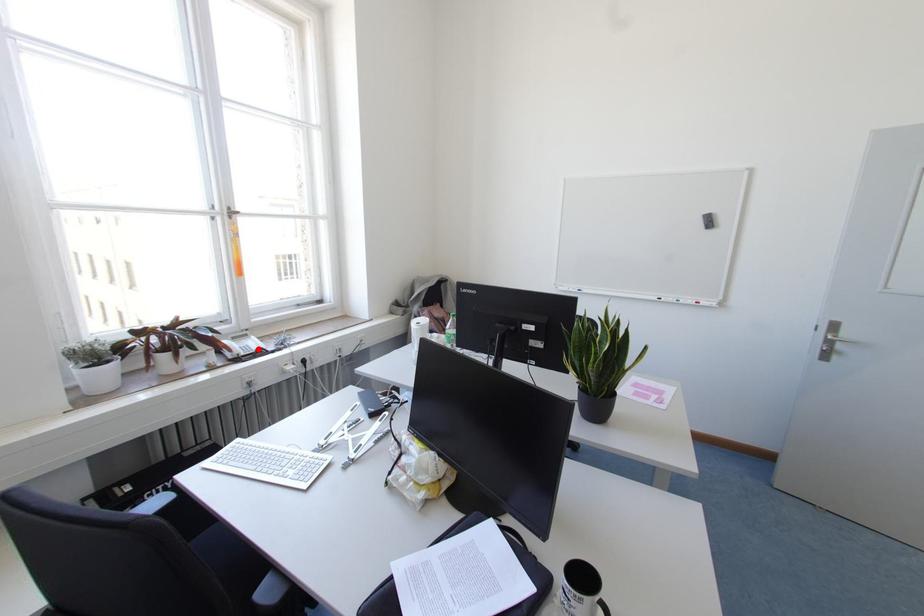
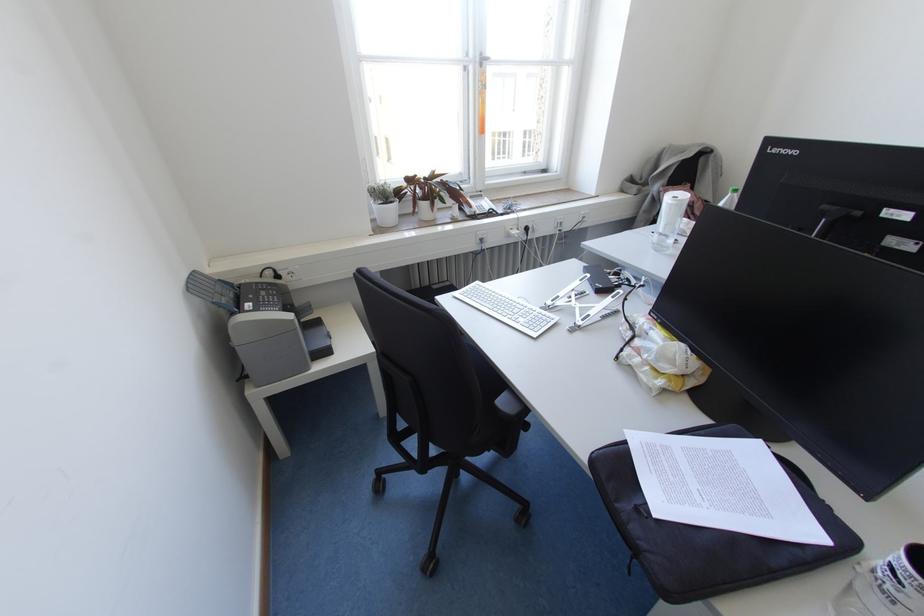
Question: I am providing you with two images of the same scene from different viewpoints. In image1, a red point is highlighted. Considering the same 3D point in image2, which of the following is correct?

Choices:
 (A) It is closer
 (B) It is farther

Answer: (A)